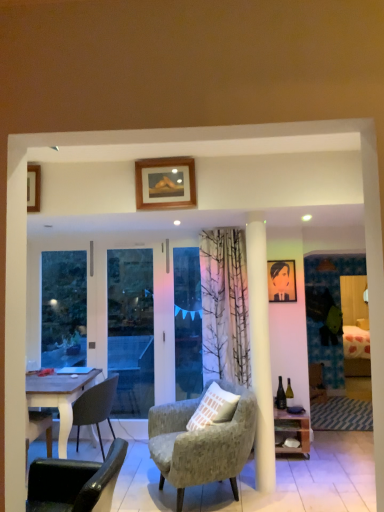
The height and width of the screenshot is (512, 384). I want to click on empty space that is to the right of wooden shelf at lower right, so (x=330, y=452).